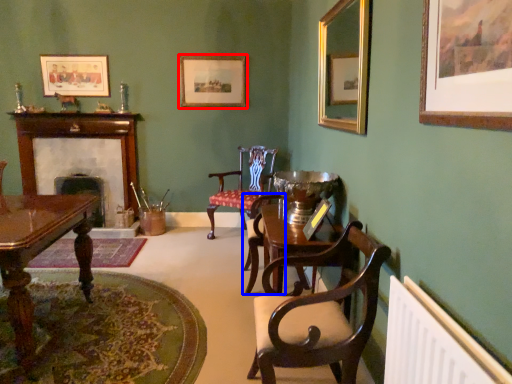
Question: Which of the following is the closest to the observer, picture frame (highlighted by a red box) or armchair (highlighted by a blue box)?

Choices:
 (A) picture frame
 (B) armchair

Answer: (B)